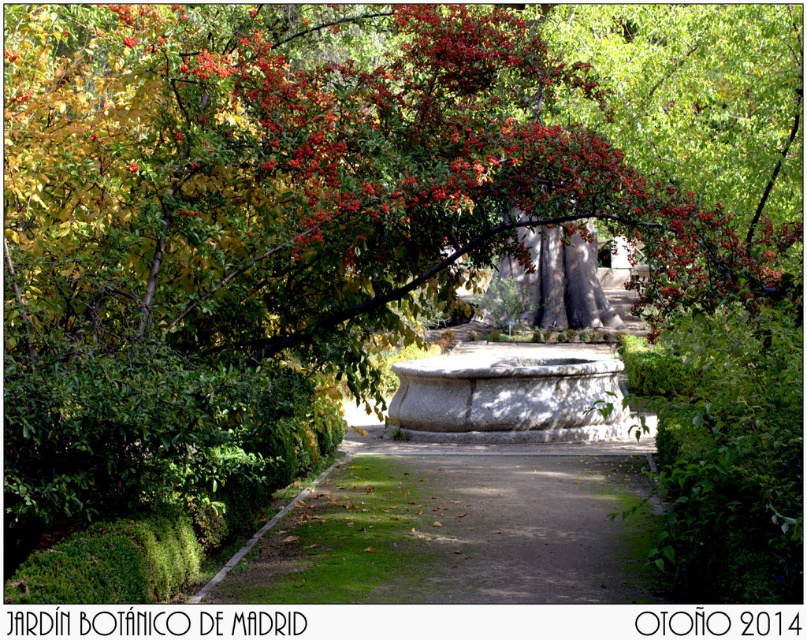
Who is more forward, (617, 540) or (431, 420)?

Point (617, 540) is more forward.

Is green gravel path at center above granite fountain at center?

No, green gravel path at center is not above granite fountain at center.

Which is behind, point (438, 480) or point (454, 358)?

Point (454, 358)

The width and height of the screenshot is (807, 640). In order to click on green gravel path at center in this screenshot , I will do `click(454, 529)`.

Can you confirm if green glossy leaves at upper center is bigger than granite fountain at center?

Yes, green glossy leaves at upper center is bigger than granite fountain at center.

Does green glossy leaves at upper center appear on the right side of granite fountain at center?

Yes, green glossy leaves at upper center is to the right of granite fountain at center.

What do you see at coordinates (387, 164) in the screenshot? I see `green glossy leaves at upper center` at bounding box center [387, 164].

Find the location of a particular element. green glossy leaves at upper center is located at coordinates (387, 164).

Can you confirm if green glossy leaves at upper center is smaller than green gravel path at center?

No, green glossy leaves at upper center is not smaller than green gravel path at center.

Is point (170, 141) positioned before point (496, 490)?

That is True.

Does point (245, 42) lie in front of point (312, 592)?

No.

The width and height of the screenshot is (807, 640). What are the coordinates of `green glossy leaves at upper center` in the screenshot? It's located at (387, 164).